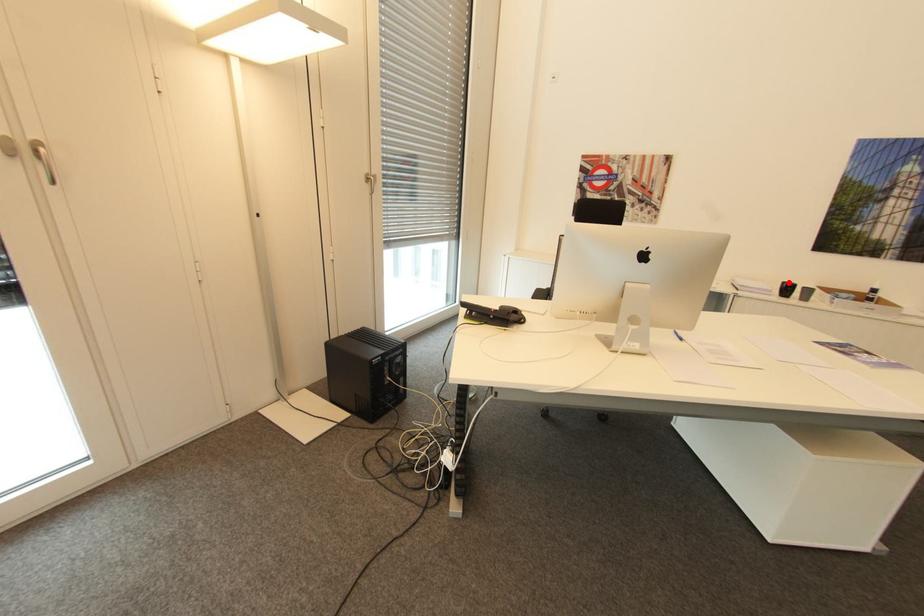
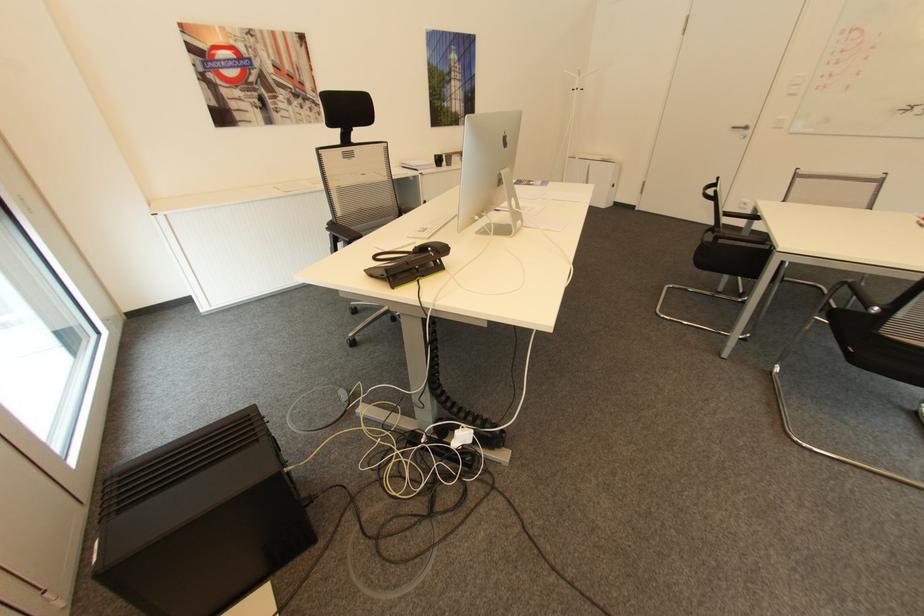
Where in the second image is the point corresponding to the highlighted location from the first image?

(441, 155)